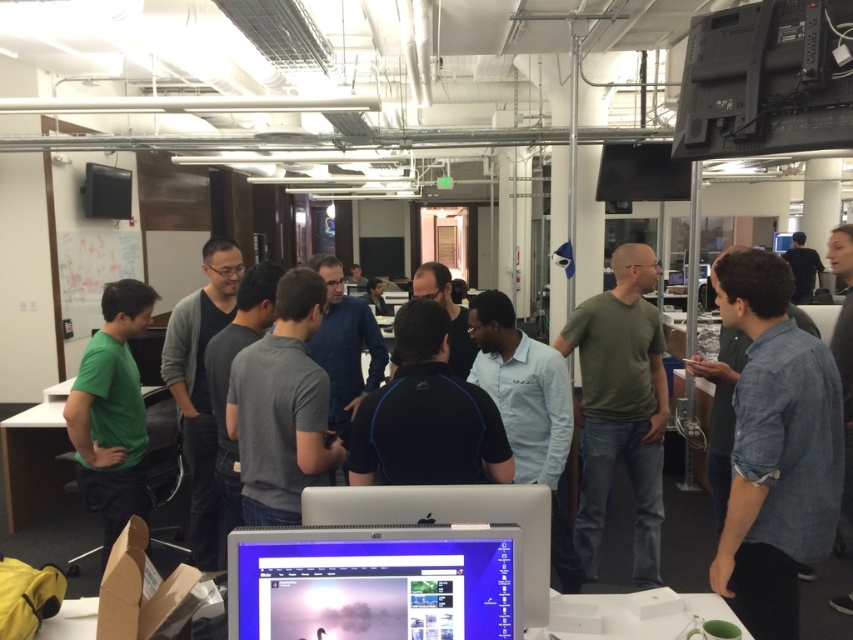
In the scene shown: Is denim shirt at right below matte black shirt at center?

Indeed, denim shirt at right is positioned under matte black shirt at center.

Where is `denim shirt at right`? This screenshot has height=640, width=853. denim shirt at right is located at coordinates (721, 410).

Describe the element at coordinates (721, 410) in the screenshot. The height and width of the screenshot is (640, 853). I see `denim shirt at right` at that location.

Where is `denim shirt at right`? The image size is (853, 640). denim shirt at right is located at coordinates point(721,410).

Does point (462, 324) come in front of point (815, 256)?

Yes, point (462, 324) is closer to viewer.

Can you confirm if dark gray shirt at center is positioned to the right of black shirt at upper right?

Incorrect, dark gray shirt at center is not on the right side of black shirt at upper right.

Which is behind, point (390, 369) or point (801, 259)?

The point (801, 259) is more distant.

I want to click on dark gray shirt at center, so point(447,314).

Between dark gray sweater at center and matte black shirt at center, which one is positioned higher?

matte black shirt at center

Describe the element at coordinates (200, 385) in the screenshot. I see `dark gray sweater at center` at that location.

Identify the location of dark gray sweater at center. The height and width of the screenshot is (640, 853). (200, 385).